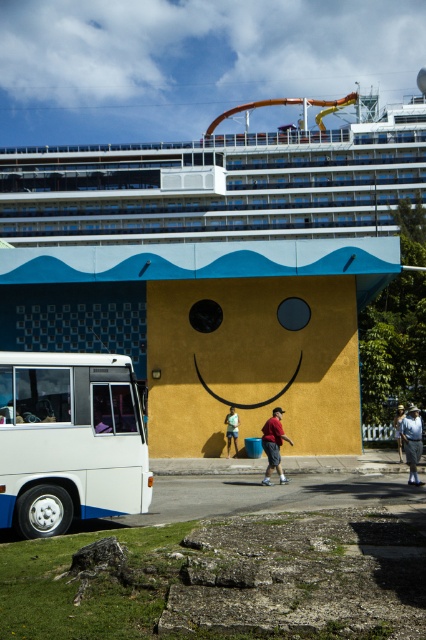
You are standing in front of the yellow wall with the smiley face and want to take a photo of the light blue fabric shirt at center. Where should you position yourself to capture the shirt in the frame?

The light blue fabric shirt at center is located at point 0.691 on the x axis and 0.967 on the y axis, so you should position yourself to aim your camera towards those coordinates to capture the shirt in the frame.

You are standing in front of the yellow wall with the smiley face and want to take a photo of the white glossy cruise ship at upper center. Where should you position yourself to ensure it is centered in your camera view? Use the coordinates provided to determine the best spot.

To center the white glossy cruise ship at upper center in your camera view, position yourself directly in front of the coordinates point at 0.287 on the x axis and 0.516 on the y axis, as this is where the cruise ship is located.

You are a photographer standing in front of the yellow wall with the smiley face. You notice two people wearing the matte red shirt at center and the light blue fabric shirt at center. Which person would you need to adjust your camera angle upwards to photograph properly?

The matte red shirt at center is much taller than the light blue fabric shirt at center, so you would need to adjust your camera angle upwards to photograph the matte red shirt at center properly.